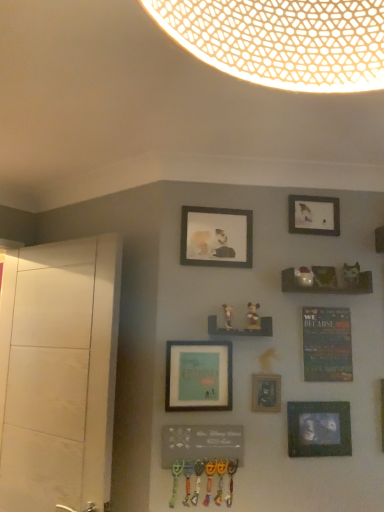
Image resolution: width=384 pixels, height=512 pixels. Describe the element at coordinates (216, 237) in the screenshot. I see `matte wooden picture frame at upper center, which ranks as the 4th picture frame in bottom-to-top order` at that location.

Locate an element on the screen. The height and width of the screenshot is (512, 384). matte blue frame at center, which appears as the 3th picture frame when viewed from the top is located at coordinates (198, 376).

Measure the distance between white matte dresser at left and camera.

The depth of white matte dresser at left is 4.99 feet.

Locate an element on the screen. Image resolution: width=384 pixels, height=512 pixels. matte black picture frame at upper right, which is the first picture frame from top to bottom is located at coordinates (314, 215).

Locate an element on the screen. The image size is (384, 512). matte black picture frame at center, arranged as the second picture frame when ordered from the bottom is located at coordinates (266, 393).

Identify the location of matte wooden picture frame at upper center, the 2th picture frame in the top-to-bottom sequence. Image resolution: width=384 pixels, height=512 pixels. (216, 237).

Considering the relative positions of matte black picture frame at lower right, which is the first picture frame from bottom to top, and matte wooden picture frame at upper center, the 2th picture frame in the top-to-bottom sequence, in the image provided, is matte black picture frame at lower right, which is the first picture frame from bottom to top, behind matte wooden picture frame at upper center, the 2th picture frame in the top-to-bottom sequence,?

No, the depth of matte black picture frame at lower right, which is the first picture frame from bottom to top, is less than that of matte wooden picture frame at upper center, the 2th picture frame in the top-to-bottom sequence.

Consider the image. Is matte black picture frame at lower right, the 5th picture frame when ordered from top to bottom, spatially inside matte wooden picture frame at upper center, the 2th picture frame in the top-to-bottom sequence, or outside of it?

matte black picture frame at lower right, the 5th picture frame when ordered from top to bottom, lies outside matte wooden picture frame at upper center, the 2th picture frame in the top-to-bottom sequence.

Is point (302, 444) less distant than point (225, 217)?

Yes.

Is matte blue frame at center, which appears as the 3th picture frame when viewed from the top, located within wooden mickey mouse figurine at center, the 3th art when ordered from right to left?

No, wooden mickey mouse figurine at center, the 3th art when ordered from right to left, does not contain matte blue frame at center, which appears as the 3th picture frame when viewed from the top.

Can you tell me how much wooden mickey mouse figurine at center, the 3th art when ordered from right to left, and matte blue frame at center, the 3th picture frame from the bottom, differ in facing direction?

wooden mickey mouse figurine at center, the 3th art when ordered from right to left, and matte blue frame at center, the 3th picture frame from the bottom, are facing 0.483 degrees away from each other.

Does wooden mickey mouse figurine at center, the first art from the left, come behind matte blue frame at center, which appears as the 3th picture frame when viewed from the top?

Yes, it is.

Which point is more forward, (210, 248) or (84, 398)?

Point (84, 398)

Considering the sizes of matte wooden picture frame at upper center, the 2th picture frame in the top-to-bottom sequence, and white matte dresser at left in the image, is matte wooden picture frame at upper center, the 2th picture frame in the top-to-bottom sequence, taller or shorter than white matte dresser at left?

In the image, matte wooden picture frame at upper center, the 2th picture frame in the top-to-bottom sequence, appears to be shorter than white matte dresser at left.

In the scene shown: Between matte wooden picture frame at upper center, the 2th picture frame in the top-to-bottom sequence, and white matte dresser at left, which one has larger size?

white matte dresser at left.

Relative to white matte dresser at left, is matte wooden picture frame at upper center, which ranks as the 4th picture frame in bottom-to-top order, in front or behind?

In the image, matte wooden picture frame at upper center, which ranks as the 4th picture frame in bottom-to-top order, appears behind white matte dresser at left.

From a real-world perspective, is matte black picture frame at center, arranged as the second picture frame when ordered from the bottom, beneath matte wooden picture frame at upper center, which ranks as the 4th picture frame in bottom-to-top order?

Yes, from a real-world perspective, matte black picture frame at center, arranged as the second picture frame when ordered from the bottom, is beneath matte wooden picture frame at upper center, which ranks as the 4th picture frame in bottom-to-top order.

Between matte black picture frame at center, which ranks as the 4th picture frame in top-to-bottom order, and matte wooden picture frame at upper center, the 2th picture frame in the top-to-bottom sequence, which one has less height?

matte black picture frame at center, which ranks as the 4th picture frame in top-to-bottom order.

Based on their sizes in the image, would you say matte black picture frame at center, arranged as the second picture frame when ordered from the bottom, is bigger or smaller than matte wooden picture frame at upper center, which ranks as the 4th picture frame in bottom-to-top order?

matte black picture frame at center, arranged as the second picture frame when ordered from the bottom, is smaller than matte wooden picture frame at upper center, which ranks as the 4th picture frame in bottom-to-top order.

In the scene shown: Between wooden shelf at center, which appears as the first shelf when viewed from the left, and wooden mickey mouse figurine at center, the first art from the left, which one is positioned behind?

Positioned behind is wooden mickey mouse figurine at center, the first art from the left.

Is point (212, 332) positioned in front of point (230, 325)?

No, (212, 332) is behind (230, 325).

At what (x,y) coordinates should I click in order to perform the action: click on shelf below the wooden mickey mouse figurine at center, the first art from the left (from the image's perspective). Please return your answer as a coordinate pair (x, y). Image resolution: width=384 pixels, height=512 pixels. Looking at the image, I should click on (240, 330).

From a real-world perspective, which is physically above, wooden shelf at center, which appears as the first shelf when viewed from the left, or wooden mickey mouse figurine at center, the 3th art when ordered from right to left?

In real-world perspective, wooden mickey mouse figurine at center, the 3th art when ordered from right to left, is above.

Considering the sizes of objects matte black picture frame at upper right, which is the fifth picture frame from bottom to top, and white matte dresser at left in the image provided, who is shorter, matte black picture frame at upper right, which is the fifth picture frame from bottom to top, or white matte dresser at left?

matte black picture frame at upper right, which is the fifth picture frame from bottom to top.

Is point (323, 214) behind point (18, 439)?

No.

Does matte black picture frame at upper right, which is the first picture frame from top to bottom, touch white matte dresser at left?

No.

Does matte black picture frame at upper right, which is the first picture frame from top to bottom, have a greater width compared to white matte dresser at left?

No, matte black picture frame at upper right, which is the first picture frame from top to bottom, is not wider than white matte dresser at left.

Is there a large distance between matte black picture frame at center, arranged as the second picture frame when ordered from the bottom, and matte brown figurine at center-right, which is the second art from right to left?

No, matte black picture frame at center, arranged as the second picture frame when ordered from the bottom, is not far away from matte brown figurine at center-right, which is the second art from right to left.

In the scene shown: Considering the sizes of matte black picture frame at center, which ranks as the 4th picture frame in top-to-bottom order, and matte brown figurine at center-right, which is the second art from right to left, in the image, is matte black picture frame at center, which ranks as the 4th picture frame in top-to-bottom order, bigger or smaller than matte brown figurine at center-right, which is the second art from right to left,?

matte black picture frame at center, which ranks as the 4th picture frame in top-to-bottom order, is bigger than matte brown figurine at center-right, which is the second art from right to left.

From a real-world perspective, is matte black picture frame at center, which ranks as the 4th picture frame in top-to-bottom order, positioned under matte brown figurine at center-right, arranged as the second art when viewed from the left, based on gravity?

Yes.

Does matte black picture frame at center, arranged as the second picture frame when ordered from the bottom, turn towards matte brown figurine at center-right, arranged as the second art when viewed from the left?

No, matte black picture frame at center, arranged as the second picture frame when ordered from the bottom, is not facing towards matte brown figurine at center-right, arranged as the second art when viewed from the left.

The image size is (384, 512). Identify the location of the 3rd picture frame above the matte black picture frame at lower right, the 5th picture frame when ordered from top to bottom (from a real-world perspective). (216, 237).

The image size is (384, 512). Identify the location of picture frame that is the 2nd object to the left of the wooden mickey mouse figurine at center, the first art from the left, starting at the anchor. (198, 376).

Estimate the real-world distances between objects in this image. Which object is closer to matte black picture frame at center, which ranks as the 4th picture frame in top-to-bottom order, matte blue frame at center, which appears as the 3th picture frame when viewed from the top, or wooden shelf at center-right, the 1th shelf in the top-to-bottom sequence?

matte blue frame at center, which appears as the 3th picture frame when viewed from the top, is closer to matte black picture frame at center, which ranks as the 4th picture frame in top-to-bottom order.

Which object lies further to the anchor point matte black picture frame at center, arranged as the second picture frame when ordered from the bottom, matte black picture frame at upper right, which is the first picture frame from top to bottom, or white matte dresser at left?

white matte dresser at left.

Estimate the real-world distances between objects in this image. Which object is further from white matte dresser at left, wooden mickey mouse figurine at center, the 3th art when ordered from right to left, or matte black picture frame at lower right, the 5th picture frame when ordered from top to bottom?

matte black picture frame at lower right, the 5th picture frame when ordered from top to bottom, is positioned further to the anchor white matte dresser at left.

Looking at the image, which one is located closer to matte brown figurine at center-right, which is the second art from right to left, wooden shelf at center, the first shelf when ordered from bottom to top, or matte black picture frame at center, arranged as the second picture frame when ordered from the bottom?

wooden shelf at center, the first shelf when ordered from bottom to top, lies closer to matte brown figurine at center-right, which is the second art from right to left, than the other object.

Considering their positions, is matte wooden picture frame at upper center, the 2th picture frame in the top-to-bottom sequence, positioned closer to wooden mickey mouse figurine at center, the 3th art when ordered from right to left, than matte black picture frame at upper right, which is the fifth picture frame from bottom to top?

matte wooden picture frame at upper center, the 2th picture frame in the top-to-bottom sequence, lies closer to wooden mickey mouse figurine at center, the 3th art when ordered from right to left, than the other object.

Looking at the image, which one is located further to matte wooden picture frame at upper center, the 2th picture frame in the top-to-bottom sequence, wooden shelf at center-right, the first shelf in the right-to-left sequence, or matte blue frame at center, which appears as the 3th picture frame when viewed from the top?

matte blue frame at center, which appears as the 3th picture frame when viewed from the top.

Which object lies nearer to the anchor point matte brown figurine at center-right, which is the second art from right to left, matte wooden picture frame at upper center, the 2th picture frame in the top-to-bottom sequence, or matte black picture frame at center, which ranks as the 4th picture frame in top-to-bottom order?

matte black picture frame at center, which ranks as the 4th picture frame in top-to-bottom order, is positioned closer to the anchor matte brown figurine at center-right, which is the second art from right to left.

In the scene shown: Looking at the image, which one is located closer to matte black picture frame at center, arranged as the second picture frame when ordered from the bottom, wooden shelf at center, which appears as the first shelf when viewed from the left, or matte white figurine at center-right, the first art positioned from the right?

wooden shelf at center, which appears as the first shelf when viewed from the left, is closer to matte black picture frame at center, arranged as the second picture frame when ordered from the bottom.

The width and height of the screenshot is (384, 512). Find the location of `shelf that lies between wooden shelf at center-right, acting as the second shelf starting from the left, and matte black picture frame at lower right, the 5th picture frame when ordered from top to bottom, from top to bottom`. shelf that lies between wooden shelf at center-right, acting as the second shelf starting from the left, and matte black picture frame at lower right, the 5th picture frame when ordered from top to bottom, from top to bottom is located at coordinates (240, 330).

The width and height of the screenshot is (384, 512). In order to click on shelf between matte brown figurine at center-right, which is the second art from right to left, and matte blue frame at center, which appears as the 3th picture frame when viewed from the top, from top to bottom in this screenshot , I will do `click(240, 330)`.

You are a GUI agent. You are given a task and a screenshot of the screen. Output one action in this format:
    pyautogui.click(x=<x>, y=<y>)
    Task: Click on the shelf between wooden shelf at center-right, acting as the second shelf starting from the left, and matte black picture frame at center, arranged as the second picture frame when ordered from the bottom, in the up-down direction
    The width and height of the screenshot is (384, 512).
    Given the screenshot: What is the action you would take?
    pyautogui.click(x=240, y=330)

Find the location of a particular element. This screenshot has width=384, height=512. picture frame between wooden mickey mouse figurine at center, the first art from the left, and matte black picture frame at center, which ranks as the 4th picture frame in top-to-bottom order, from top to bottom is located at coordinates click(x=198, y=376).